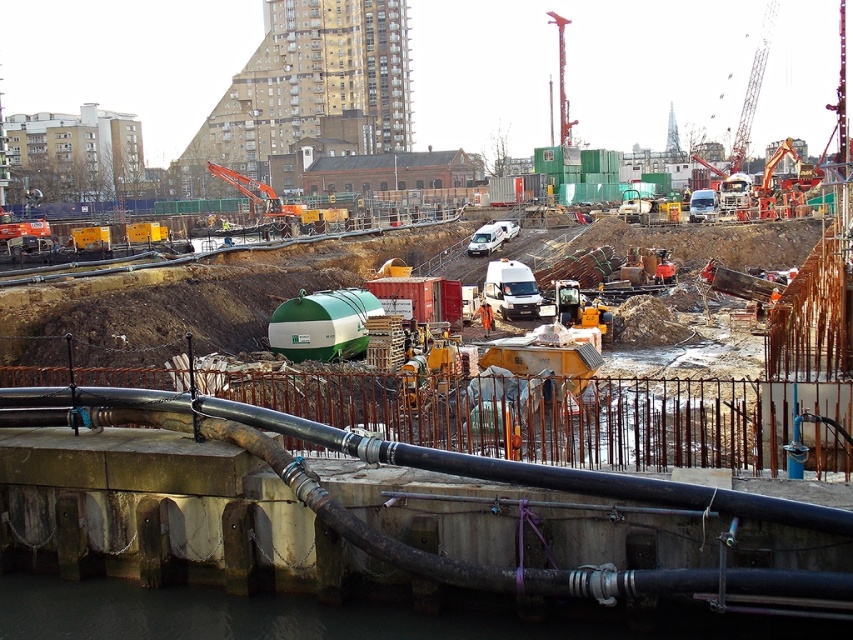
Question: Which of these objects is positioned farthest from the green matte tank at center?

Choices:
 (A) yellow metallic train track at center
 (B) red metal crane at upper center
 (C) white matte van at center
 (D) metallic orange crane at upper right

Answer: (B)

Question: Can you confirm if yellow metallic train track at center is bigger than white matte van at center?

Choices:
 (A) no
 (B) yes

Answer: (B)

Question: Which point appears farthest from the camera in this image?

Choices:
 (A) (393, 433)
 (B) (747, 132)
 (C) (511, 276)
 (D) (135, 266)

Answer: (B)

Question: Observing the image, what is the correct spatial positioning of green matte tank at center in reference to white matte van at center?

Choices:
 (A) left
 (B) right

Answer: (A)

Question: Which object is closer to the camera taking this photo?

Choices:
 (A) green matte tank at center
 (B) metallic orange crane at upper right

Answer: (A)

Question: Is white matte van at center below metallic orange crane at upper right?

Choices:
 (A) no
 (B) yes

Answer: (B)